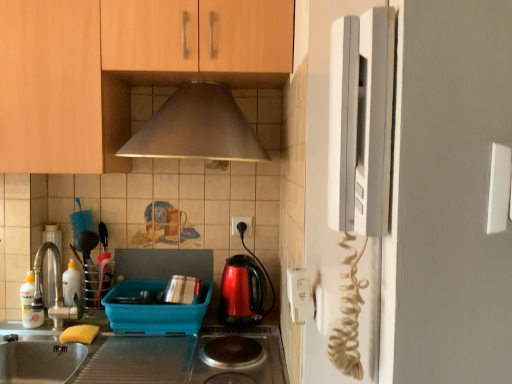
This screenshot has width=512, height=384. Find the location of `free space above metallic silver exhaust hood at upper center (from a real-world perspective)`. free space above metallic silver exhaust hood at upper center (from a real-world perspective) is located at coordinates (186, 76).